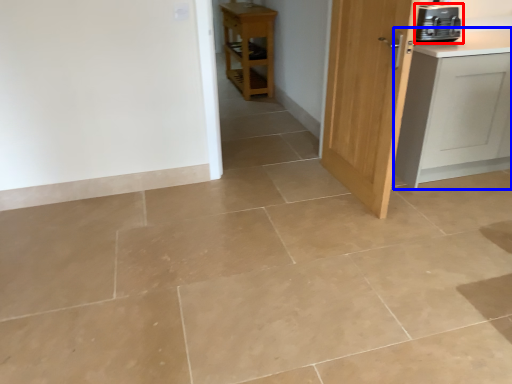
Question: Among these objects, which one is nearest to the camera, home appliance (highlighted by a red box) or cabinetry (highlighted by a blue box)?

Choices:
 (A) home appliance
 (B) cabinetry

Answer: (B)